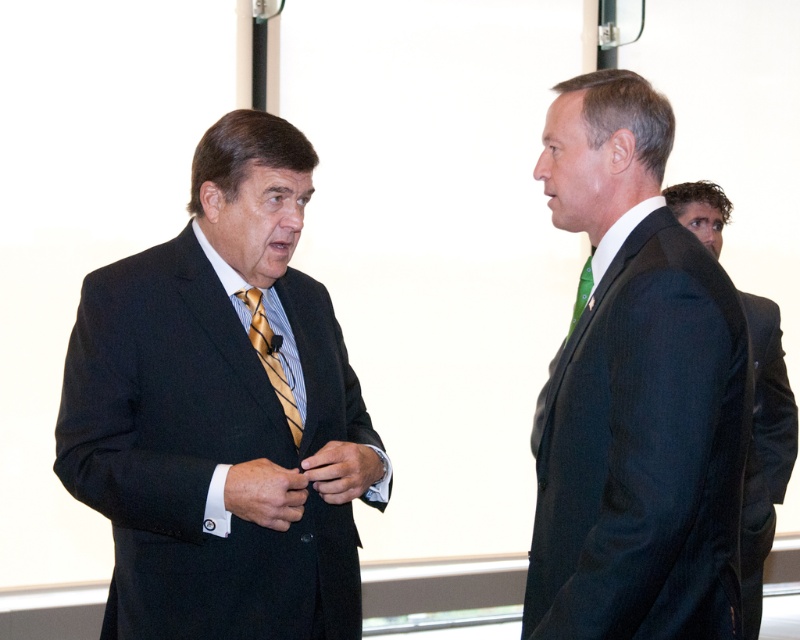
Is dark green suit at right smaller than dark gray suit at right?

Correct, dark green suit at right occupies less space than dark gray suit at right.

Does point (748, 396) come closer to viewer compared to point (766, 381)?

Yes, it is.

Does point (594, 513) come closer to viewer compared to point (708, 248)?

Yes.

Find the location of a particular element. dark green suit at right is located at coordinates tap(636, 396).

Is dark green suit at right to the left of black wool suit at right from the viewer's perspective?

Correct, you'll find dark green suit at right to the left of black wool suit at right.

Is dark green suit at right below black wool suit at right?

No.

At what (x,y) coordinates should I click in order to perform the action: click on dark green suit at right. Please return your answer as a coordinate pair (x, y). The image size is (800, 640). Looking at the image, I should click on (636, 396).

Where is `dark green suit at right`? The image size is (800, 640). dark green suit at right is located at coordinates (636, 396).

Is dark green suit at right smaller than green silk tie at right?

Actually, dark green suit at right might be larger than green silk tie at right.

Who is positioned more to the left, dark green suit at right or green silk tie at right?

Positioned to the left is dark green suit at right.

Does point (624, 349) come in front of point (588, 272)?

Yes, point (624, 349) is in front of point (588, 272).

This screenshot has width=800, height=640. I want to click on dark green suit at right, so click(636, 396).